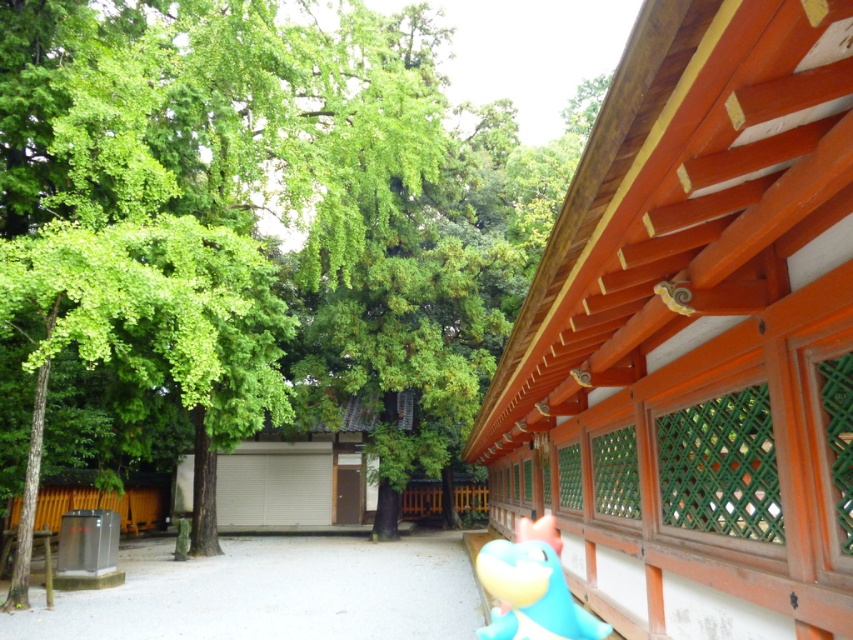
You are a visitor at this Japanese shrine and notice two items in the scene. One is the green leafy tree at upper left and the other is the teal rubber toy at lower right. Which of these two items appears wider in the image?

The green leafy tree at upper left appears wider than the teal rubber toy at lower right because its width is larger according to the description.

You are a visitor at the temple and want to pick up the teal rubber toy at lower right. To reach it, you need to walk around the green leafy tree at upper left. Which direction should you walk around the tree to get to the toy?

The teal rubber toy at lower right is behind the green leafy tree at upper left, so you should walk around the tree to your right side to reach the toy.